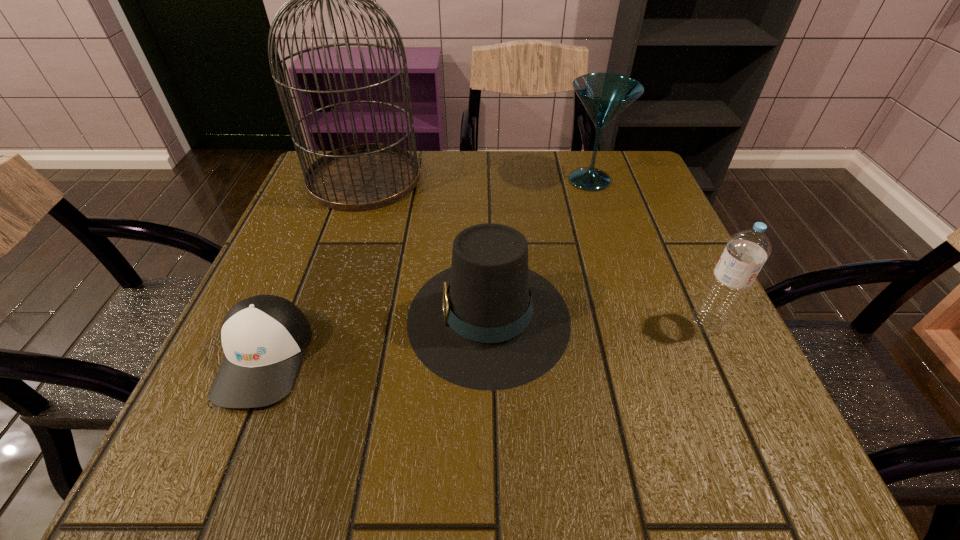
Locate an element on the screen. The image size is (960, 540). free spot that satisfies the following two spatial constraints: 1. on the front-facing side of the second shortest object; 2. on the front panel of the shortest object is located at coordinates (490, 357).

Find the location of a particular element. The width and height of the screenshot is (960, 540). vacant space that satisfies the following two spatial constraints: 1. on the front side of the birdcage; 2. on the right side of the rightmost object is located at coordinates (316, 322).

Identify the location of free location that satisfies the following two spatial constraints: 1. on the front-facing side of the third object from left to right; 2. on the front panel of the cap. (490, 357).

Find the location of a particular element. vacant region that satisfies the following two spatial constraints: 1. on the front-facing side of the second shortest object; 2. on the back side of the water bottle is located at coordinates (489, 322).